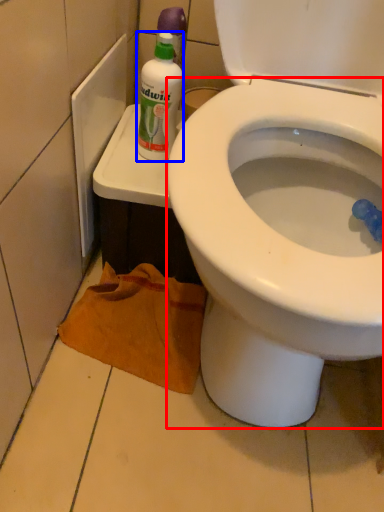
Question: Which point is closer to the camera, bidet (highlighted by a red box) or cleaning product (highlighted by a blue box)?

Choices:
 (A) bidet
 (B) cleaning product

Answer: (A)